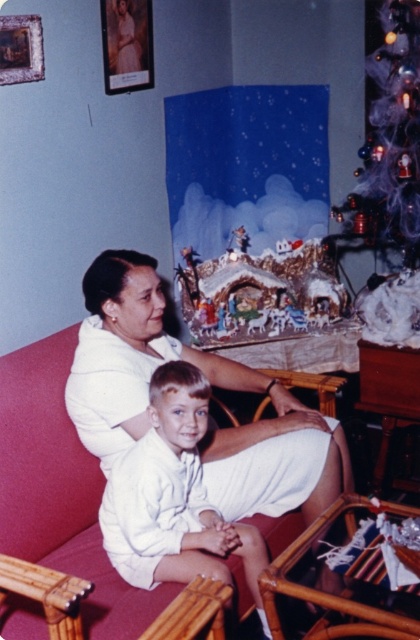
Question: Which point is closer to the camera taking this photo?

Choices:
 (A) (380, 61)
 (B) (100, 12)
 (C) (23, 548)

Answer: (C)

Question: Which of the following is the closest to the observer?

Choices:
 (A) velvet red couch at center
 (B) light brown hair at center

Answer: (A)

Question: Based on their relative distances, which object is farther from the wooden picture frame at upper left?

Choices:
 (A) light brown hair at center
 (B) translucent purple tinsel at upper right
 (C) velvet red couch at center

Answer: (A)

Question: Is bamboo armchair at lower right wider than wooden picture frame at upper left?

Choices:
 (A) no
 (B) yes

Answer: (B)

Question: Can you confirm if velvet red couch at center is bigger than translucent purple tinsel at upper right?

Choices:
 (A) yes
 (B) no

Answer: (A)

Question: Can you confirm if matte white portrait at upper left is wider than wooden picture frame at upper left?

Choices:
 (A) yes
 (B) no

Answer: (A)